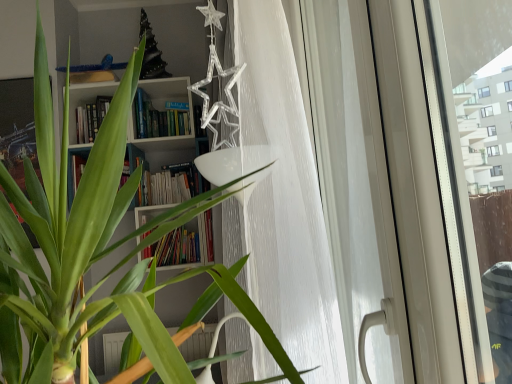
This screenshot has height=384, width=512. What do you see at coordinates (355, 185) in the screenshot?
I see `white glossy screen door at right` at bounding box center [355, 185].

Where is `white glossy screen door at right`? The height and width of the screenshot is (384, 512). white glossy screen door at right is located at coordinates (355, 185).

The height and width of the screenshot is (384, 512). Describe the element at coordinates (282, 198) in the screenshot. I see `white textured curtain at center` at that location.

Measure the distance between white textured curtain at center and camera.

The depth of white textured curtain at center is 1.08 meters.

At what (x,y) coordinates should I click in order to perform the action: click on white textured curtain at center. Please return your answer as a coordinate pair (x, y). The image size is (512, 384). Looking at the image, I should click on (282, 198).

Where is `white glossy screen door at right`? This screenshot has height=384, width=512. white glossy screen door at right is located at coordinates (355, 185).

Considering the positions of objects white textured curtain at center and white glossy screen door at right in the image provided, who is more to the left, white textured curtain at center or white glossy screen door at right?

white textured curtain at center.

Relative to white glossy screen door at right, is white textured curtain at center in front or behind?

In the image, white textured curtain at center appears behind white glossy screen door at right.

Considering the points (302, 363) and (360, 68), which point is in front, point (302, 363) or point (360, 68)?

The point (360, 68) is closer.

From the image's perspective, which is below, white textured curtain at center or white glossy screen door at right?

white glossy screen door at right appears lower in the image.

In the scene shown: From a real-world perspective, is white textured curtain at center over white glossy screen door at right?

Indeed, from a real-world perspective, white textured curtain at center stands above white glossy screen door at right.

Is white textured curtain at center thinner than white glossy screen door at right?

In fact, white textured curtain at center might be wider than white glossy screen door at right.

Does white textured curtain at center have a greater height compared to white glossy screen door at right?

Yes, white textured curtain at center is taller than white glossy screen door at right.

Who is smaller, white textured curtain at center or white glossy screen door at right?

Smaller between the two is white glossy screen door at right.

Is white textured curtain at center outside of white glossy screen door at right?

Absolutely, white textured curtain at center is external to white glossy screen door at right.

From the picture: Are white textured curtain at center and white glossy screen door at right making contact?

No, white textured curtain at center is not next to white glossy screen door at right.

Could you tell me if white textured curtain at center is facing white glossy screen door at right?

Yes, white textured curtain at center is oriented towards white glossy screen door at right.

How many degrees apart are the facing directions of white textured curtain at center and white glossy screen door at right?

2.38 degrees.

Locate an element on the screen. screen door below the white textured curtain at center (from a real-world perspective) is located at coordinates (355, 185).

Which is more to the left, white glossy screen door at right or white textured curtain at center?

From the viewer's perspective, white textured curtain at center appears more on the left side.

Which object is closer to the camera, white glossy screen door at right or white textured curtain at center?

white glossy screen door at right is in front.

Which is behind, point (362, 309) or point (241, 342)?

The point (241, 342) is more distant.

From the image's perspective, is white glossy screen door at right above white textured curtain at center?

No, from the image's perspective, white glossy screen door at right is not on top of white textured curtain at center.

Looking at this image, from a real-world perspective, between white glossy screen door at right and white textured curtain at center, who is vertically lower?

white glossy screen door at right is physically lower.

Does white glossy screen door at right have a lesser width compared to white textured curtain at center?

Yes.

Who is taller, white glossy screen door at right or white textured curtain at center?

white textured curtain at center.

Is white glossy screen door at right bigger or smaller than white textured curtain at center?

white glossy screen door at right is smaller than white textured curtain at center.

Is white glossy screen door at right outside of white textured curtain at center?

That's correct, white glossy screen door at right is outside of white textured curtain at center.

Is the surface of white glossy screen door at right in direct contact with white textured curtain at center?

No, white glossy screen door at right is not making contact with white textured curtain at center.

Is white glossy screen door at right oriented away from white textured curtain at center?

Correct, white glossy screen door at right is looking away from white textured curtain at center.

Where is `curtain located above the white glossy screen door at right (from the image's perspective)`? curtain located above the white glossy screen door at right (from the image's perspective) is located at coordinates (282, 198).

Image resolution: width=512 pixels, height=384 pixels. I want to click on screen door in front of the white textured curtain at center, so (355, 185).

The image size is (512, 384). I want to click on screen door lying below the white textured curtain at center (from the image's perspective), so click(355, 185).